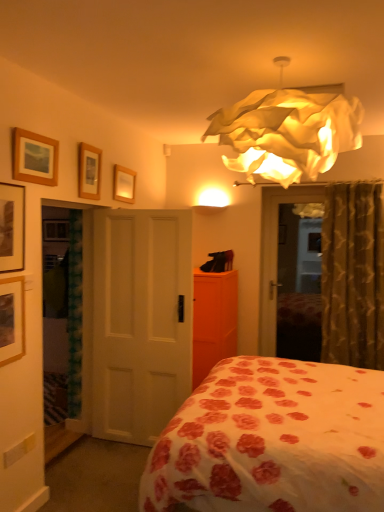
Question: Is white floral fabric bed at center smaller than wooden picture frame at left, the first picture frame in the front-to-back sequence?

Choices:
 (A) no
 (B) yes

Answer: (A)

Question: Could you tell me if white floral fabric bed at center is turned towards wooden picture frame at left, arranged as the 1th picture frame when viewed from the left?

Choices:
 (A) yes
 (B) no

Answer: (A)

Question: Is white floral fabric bed at center not close to wooden picture frame at left, placed as the 5th picture frame when sorted from back to front?

Choices:
 (A) yes
 (B) no

Answer: (A)

Question: From the image's perspective, is white floral fabric bed at center under wooden picture frame at left, placed as the 5th picture frame when sorted from back to front?

Choices:
 (A) no
 (B) yes

Answer: (B)

Question: Is white floral fabric bed at center not within wooden picture frame at left, the first picture frame in the front-to-back sequence?

Choices:
 (A) yes
 (B) no

Answer: (A)

Question: Considering the positions of illuminated paper-like lampshade at upper center and orange matte dresser at center in the image, is illuminated paper-like lampshade at upper center taller or shorter than orange matte dresser at center?

Choices:
 (A) tall
 (B) short

Answer: (B)

Question: Considering their positions, is illuminated paper-like lampshade at upper center located in front of or behind orange matte dresser at center?

Choices:
 (A) front
 (B) behind

Answer: (A)

Question: From a real-world perspective, is illuminated paper-like lampshade at upper center positioned above or below orange matte dresser at center?

Choices:
 (A) below
 (B) above

Answer: (B)

Question: Looking at the image, does illuminated paper-like lampshade at upper center seem bigger or smaller compared to orange matte dresser at center?

Choices:
 (A) small
 (B) big

Answer: (A)

Question: From the image's perspective, is orange matte dresser at center above or below wooden picture frame at upper center, the second picture frame when ordered from back to front?

Choices:
 (A) above
 (B) below

Answer: (B)

Question: From their relative heights in the image, would you say orange matte dresser at center is taller or shorter than wooden picture frame at upper center, the 2th picture frame from the right?

Choices:
 (A) short
 (B) tall

Answer: (B)

Question: Is orange matte dresser at center in front of or behind wooden picture frame at upper center, the second picture frame when ordered from back to front, in the image?

Choices:
 (A) front
 (B) behind

Answer: (B)

Question: Is orange matte dresser at center inside or outside of wooden picture frame at upper center, the second picture frame when ordered from back to front?

Choices:
 (A) outside
 (B) inside

Answer: (A)

Question: Considering the positions of wooden picture frame at upper center, the 5th picture frame when ordered from left to right, and matte black picture frame at upper left, which ranks as the 2th picture frame in front-to-back order, in the image, is wooden picture frame at upper center, the 5th picture frame when ordered from left to right, wider or thinner than matte black picture frame at upper left, which ranks as the 2th picture frame in front-to-back order,?

Choices:
 (A) wide
 (B) thin

Answer: (B)

Question: Is wooden picture frame at upper center, placed as the fifth picture frame when sorted from front to back, taller or shorter than matte black picture frame at upper left, positioned as the 4th picture frame in back-to-front order?

Choices:
 (A) tall
 (B) short

Answer: (B)